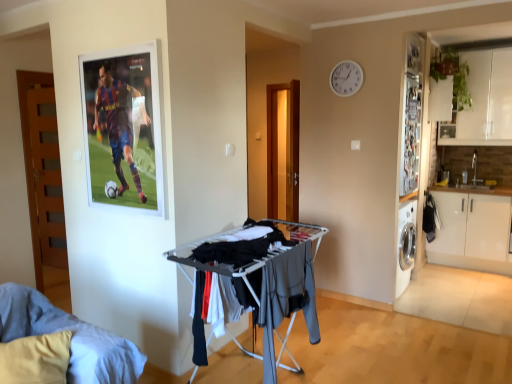
Question: Does white matte cabinet at right have a greater width compared to light blue fabric bed at lower left?

Choices:
 (A) yes
 (B) no

Answer: (B)

Question: Is white matte cabinet at right positioned in front of light blue fabric bed at lower left?

Choices:
 (A) yes
 (B) no

Answer: (B)

Question: Considering the relative positions of white matte cabinet at right and light blue fabric bed at lower left in the image provided, is white matte cabinet at right to the left of light blue fabric bed at lower left from the viewer's perspective?

Choices:
 (A) no
 (B) yes

Answer: (A)

Question: Is there a large distance between white matte cabinet at right and light blue fabric bed at lower left?

Choices:
 (A) yes
 (B) no

Answer: (A)

Question: Is white matte cabinet at right positioned with its back to light blue fabric bed at lower left?

Choices:
 (A) no
 (B) yes

Answer: (A)

Question: Could you tell me if white matte cabinet at right is facing light blue fabric bed at lower left?

Choices:
 (A) yes
 (B) no

Answer: (A)

Question: Does dark gray fabric drying rack at center come behind light blue fabric bed at lower left?

Choices:
 (A) yes
 (B) no

Answer: (A)

Question: From a real-world perspective, is dark gray fabric drying rack at center physically above light blue fabric bed at lower left?

Choices:
 (A) yes
 (B) no

Answer: (A)

Question: From the image's perspective, would you say dark gray fabric drying rack at center is positioned over light blue fabric bed at lower left?

Choices:
 (A) yes
 (B) no

Answer: (A)

Question: Is dark gray fabric drying rack at center at the left side of light blue fabric bed at lower left?

Choices:
 (A) yes
 (B) no

Answer: (B)

Question: Is light blue fabric bed at lower left a part of dark gray fabric drying rack at center?

Choices:
 (A) yes
 (B) no

Answer: (B)

Question: From a real-world perspective, is dark gray fabric drying rack at center physically below light blue fabric bed at lower left?

Choices:
 (A) no
 (B) yes

Answer: (A)

Question: Is white matte cabinet at right turned away from dark gray fabric drying rack at center?

Choices:
 (A) yes
 (B) no

Answer: (B)